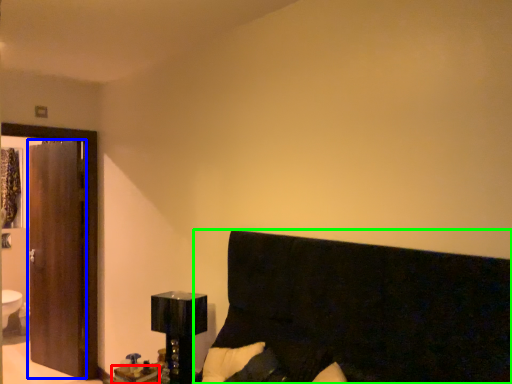
Question: Estimate the real-world distances between objects in this image. Which object is farther from table (highlighted by a red box), screen door (highlighted by a blue box) or furniture (highlighted by a green box)?

Choices:
 (A) screen door
 (B) furniture

Answer: (A)